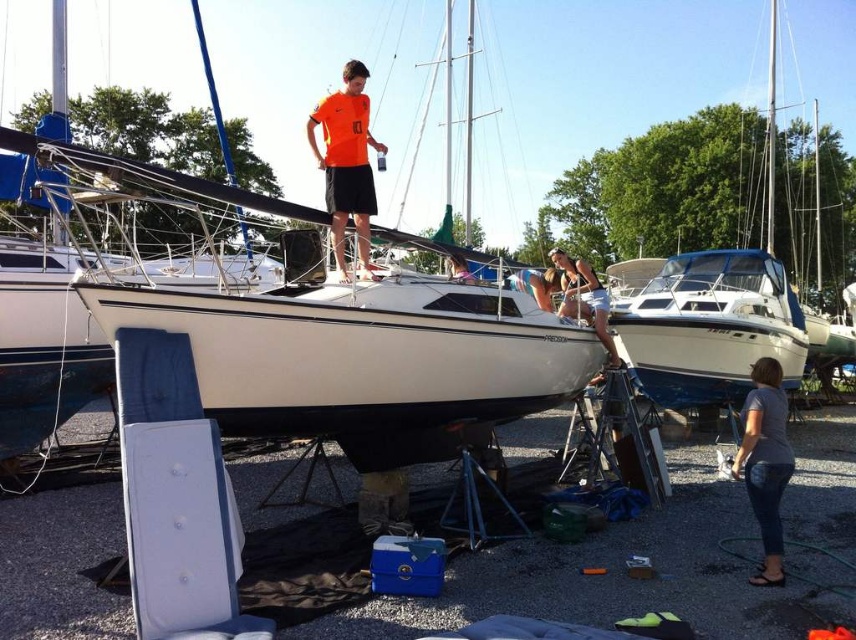
You are navigating a small drone over the marina and need to locate the orange matte shirt at center. According to the coordinates provided, where exactly is the orange matte shirt positioned?

The orange matte shirt at center is located at point coordinates (346, 163).

You are a photographer planning to take a group photo of the people and the boat in the marina. Given that the white glossy boat at center and the matte white tank top at center are both in the frame, which object should you focus on first to ensure proper framing?

The matte white tank top at center should be focused on first because it is larger than the white glossy boat at center, ensuring it fits well within the frame.